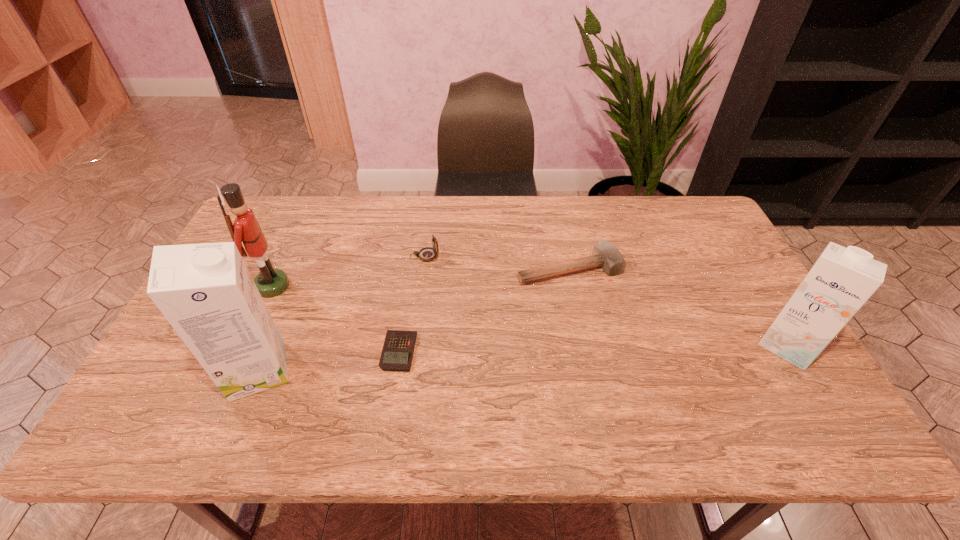
The height and width of the screenshot is (540, 960). What are the coordinates of `the left carton` in the screenshot? It's located at (205, 291).

At what (x,y) coordinates should I click in order to perform the action: click on the shorter carton. Please return your answer as a coordinate pair (x, y). The height and width of the screenshot is (540, 960). Looking at the image, I should click on (840, 282).

Image resolution: width=960 pixels, height=540 pixels. What are the coordinates of `the right carton` in the screenshot? It's located at (840, 282).

What are the coordinates of `the fourth tallest object` in the screenshot? It's located at (427, 254).

At what (x,y) coordinates should I click in order to perform the action: click on the second shortest object. Please return your answer as a coordinate pair (x, y). This screenshot has width=960, height=540. Looking at the image, I should click on (606, 255).

Locate an element on the screen. Image resolution: width=960 pixels, height=540 pixels. mallet is located at coordinates (606, 255).

The height and width of the screenshot is (540, 960). Find the location of `the shortest object`. the shortest object is located at coordinates (397, 353).

Identify the location of nutcracker. (270, 282).

You are a GUI agent. You are given a task and a screenshot of the screen. Output one action in this format:
    pyautogui.click(x=<x>, y=<y>)
    Task: Click on the blank area located 0.370m on the right of the taller carton
    The image size is (960, 540).
    Given the screenshot: What is the action you would take?
    pyautogui.click(x=444, y=370)

Find the location of `free region located 0.170m on the back of the right carton`. free region located 0.170m on the back of the right carton is located at coordinates (747, 277).